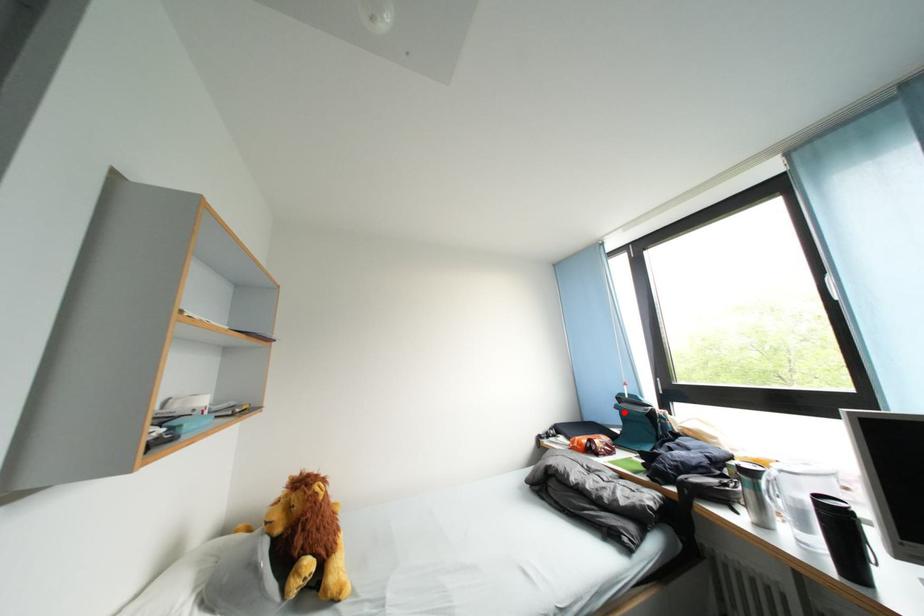
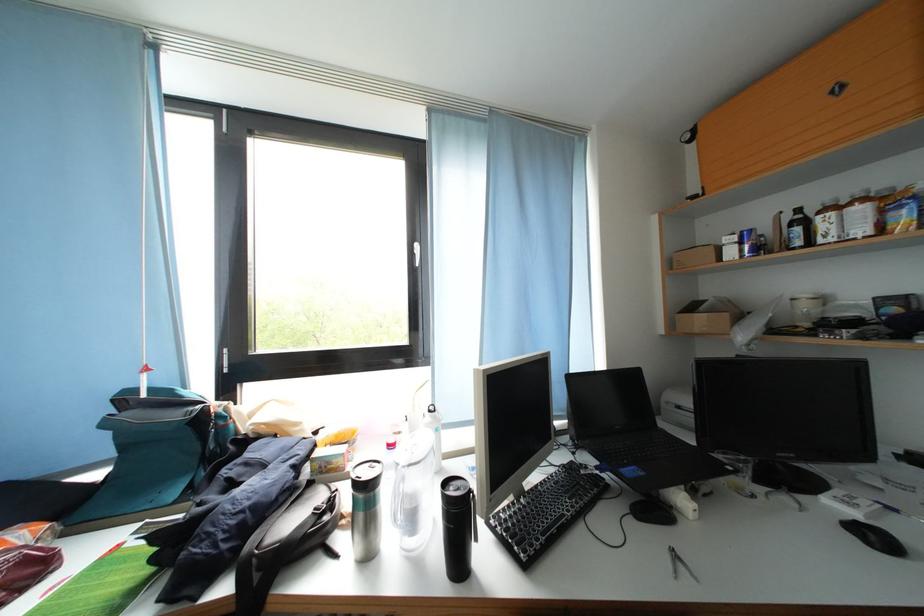
The point at the highlighted location is marked in the first image. Where is the corresponding point in the second image?

(114, 429)